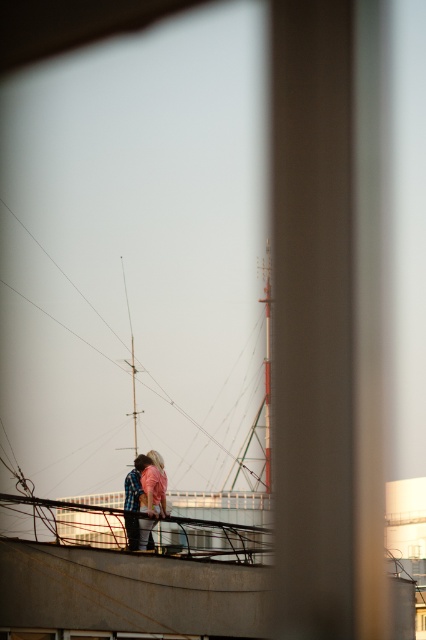
You are a photographer trying to capture the pink fabric at center and the metallic mast at center in a single frame. Based on their heights, which object will appear taller in the photo?

The metallic mast at center is taller than the pink fabric at center, so it will appear taller in the photo.

Based on the scene description, where is the metallic mast at center located in the image?

The metallic mast at center is located at point (267, 364).